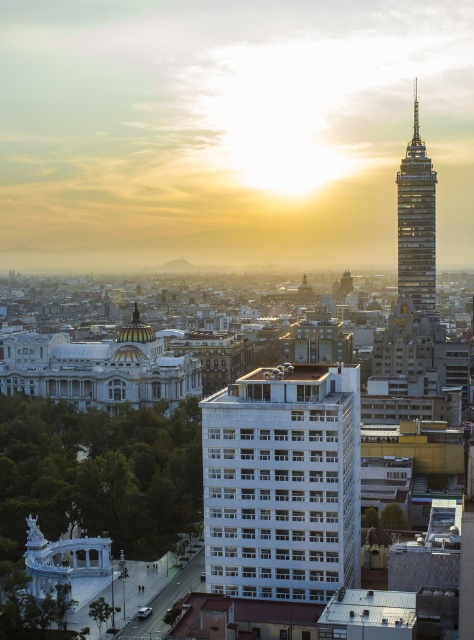
You are a drone operator trying to capture a photo of the white smooth building at center from above. The drone has a maximum flight range of 400 feet. Can the drone reach the building without exceeding its range?

The white smooth building at center is 422.21 feet away from the drone, so the drone cannot reach it without exceeding its 400 feet range.

You are standing in the city looking at the white smooth building at center and the shiny glass tower at upper right. Which of these two buildings is positioned to the left of the other?

The white smooth building at center is positioned to the left of the shiny glass tower at upper right.

You are an urban planner analyzing the city layout. Given the white smooth building at center and the shiny glass tower at upper right, which one takes up more area in the image?

The shiny glass tower at upper right occupies more space in the image than the white smooth building at center.